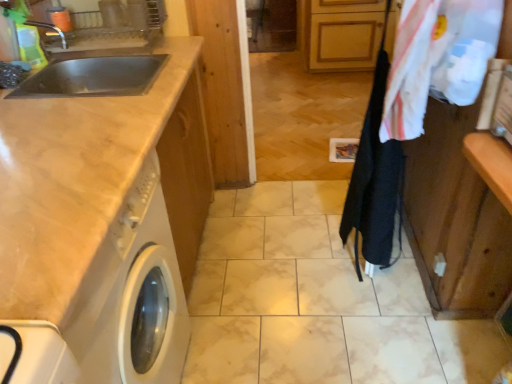
Question: Is point (79, 165) closer or farther from the camera than point (143, 309)?

Choices:
 (A) farther
 (B) closer

Answer: (B)

Question: From the image's perspective, is matte beige countertop at left located above or below white glossy washing machine at left?

Choices:
 (A) above
 (B) below

Answer: (A)

Question: Considering the real-world distances, which object is closest to the white glossy washing machine at left?

Choices:
 (A) white cotton laundry at upper right
 (B) black fabric clothesline at center-right
 (C) matte beige countertop at left

Answer: (C)

Question: Which object is positioned closest to the white cotton laundry at upper right?

Choices:
 (A) matte beige countertop at left
 (B) black fabric clothesline at center-right
 (C) white glossy washing machine at left

Answer: (B)